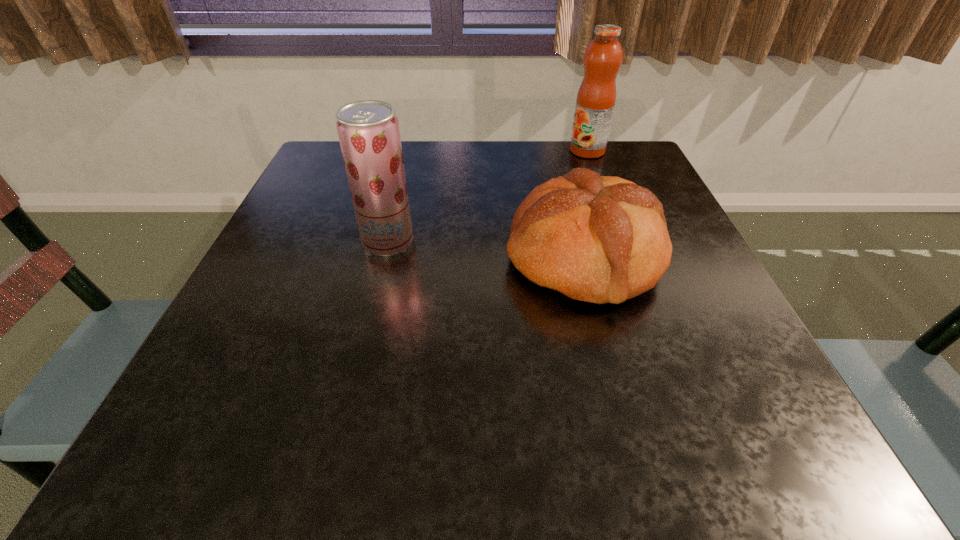
Locate an element on the screen. The image size is (960, 540). object that is at the far edge is located at coordinates (596, 97).

The width and height of the screenshot is (960, 540). I want to click on fruit juice that is at the right edge, so click(x=596, y=97).

Locate an element on the screen. The image size is (960, 540). bread that is at the right edge is located at coordinates (601, 239).

Find the location of a particular element. Image resolution: width=960 pixels, height=540 pixels. object located in the far right corner section of the desktop is located at coordinates pyautogui.click(x=596, y=97).

In the image, there is a desktop. In order to click on vacant space at the far edge in this screenshot , I will do `click(521, 147)`.

This screenshot has height=540, width=960. I want to click on free space at the near edge of the desktop, so click(x=373, y=413).

The width and height of the screenshot is (960, 540). I want to click on vacant region at the left edge of the desktop, so click(x=313, y=261).

I want to click on free region at the right edge, so click(708, 275).

Where is `free spot at the far left corner of the desktop`? The image size is (960, 540). free spot at the far left corner of the desktop is located at coordinates (342, 163).

Find the location of a particular element. The width and height of the screenshot is (960, 540). vacant space at the far right corner of the desktop is located at coordinates pos(644,187).